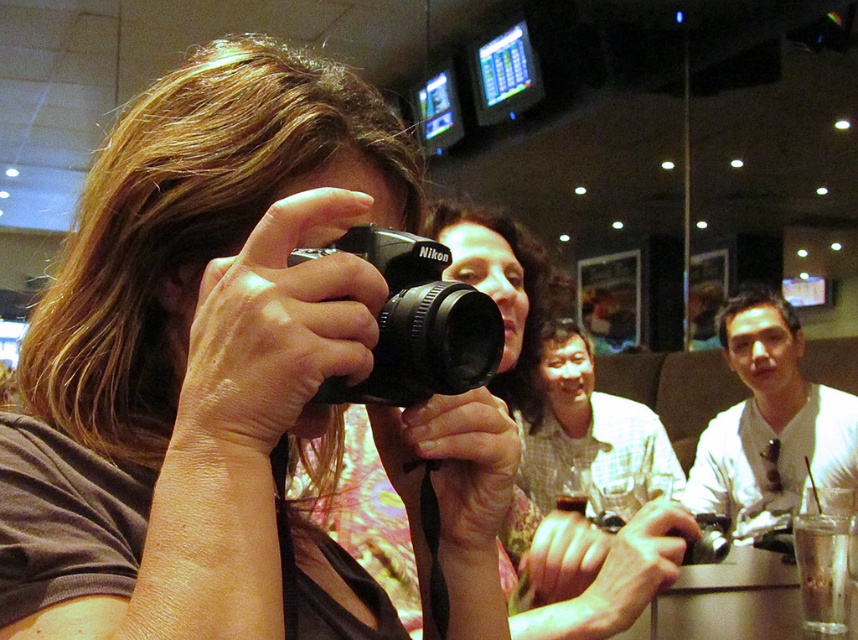
Who is lower down, white shirt at center or black matte nikon camera at center?

white shirt at center is lower down.

Describe the element at coordinates (770, 424) in the screenshot. I see `white shirt at center` at that location.

You are a GUI agent. You are given a task and a screenshot of the screen. Output one action in this format:
    pyautogui.click(x=<x>, y=<y>)
    Task: Click on the white shirt at center
    This screenshot has width=858, height=640.
    Given the screenshot: What is the action you would take?
    pyautogui.click(x=770, y=424)

Looking at this image, is floral fabric shirt at center to the right of white shirt at center from the viewer's perspective?

Incorrect, floral fabric shirt at center is not on the right side of white shirt at center.

Who is taller, floral fabric shirt at center or white shirt at center?

white shirt at center is taller.

Identify the location of floral fabric shirt at center. (597, 572).

Identify the location of floral fabric shirt at center. This screenshot has width=858, height=640. 597,572.

Measure the distance between floral fabric shirt at center and black matte nikon camera at center.

The distance of floral fabric shirt at center from black matte nikon camera at center is 15.56 inches.

Looking at this image, can you confirm if floral fabric shirt at center is positioned to the right of black matte nikon camera at center?

Yes, floral fabric shirt at center is to the right of black matte nikon camera at center.

Describe the element at coordinates (597, 572) in the screenshot. The width and height of the screenshot is (858, 640). I see `floral fabric shirt at center` at that location.

Identify the location of floral fabric shirt at center. 597,572.